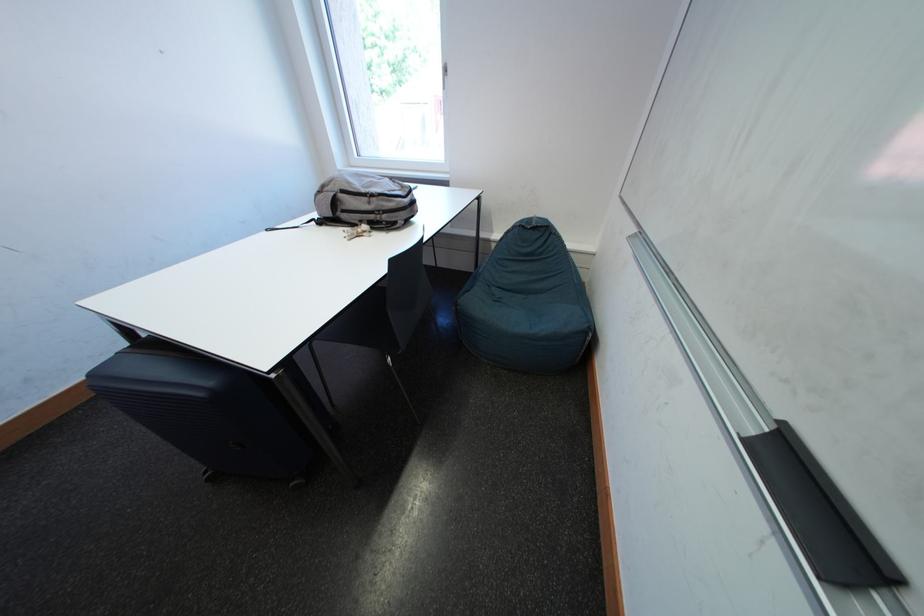
In order to click on backpack zipper pull in this screenshot , I will do `click(368, 196)`.